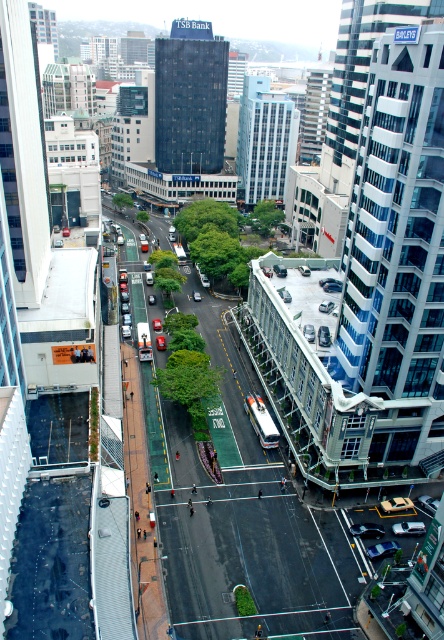
You are a delivery person needing to park your metallic silver car at lower right near the intersection. Based on the scene, where is the best spot to park it?

The metallic silver car at lower right should be parked at point (x=381, y=548) as specified in the description to ensure proper positioning near the intersection.

You are a pedestrian standing on the sidewalk on the left side of the road. You want to cross to the sidewalk on the right side. The shiny silver sedan at center and the metallic silver car at lower right are both in your path. Which car is closer to you and would you need to avoid first?

The shiny silver sedan at center is closer to you than the metallic silver car at lower right, so you should avoid it first.

You are a pedestrian standing on the sidewalk on the left side of the road. You need to cross to the metallic silver car at lower right and the sleek silver sedan at center. Which car should you head towards first based on their positions?

The metallic silver car at lower right is positioned on the left side of the sleek silver sedan at center, so you should head towards the metallic silver car at lower right first as it is closer to your starting position on the sidewalk on the left side of the road.